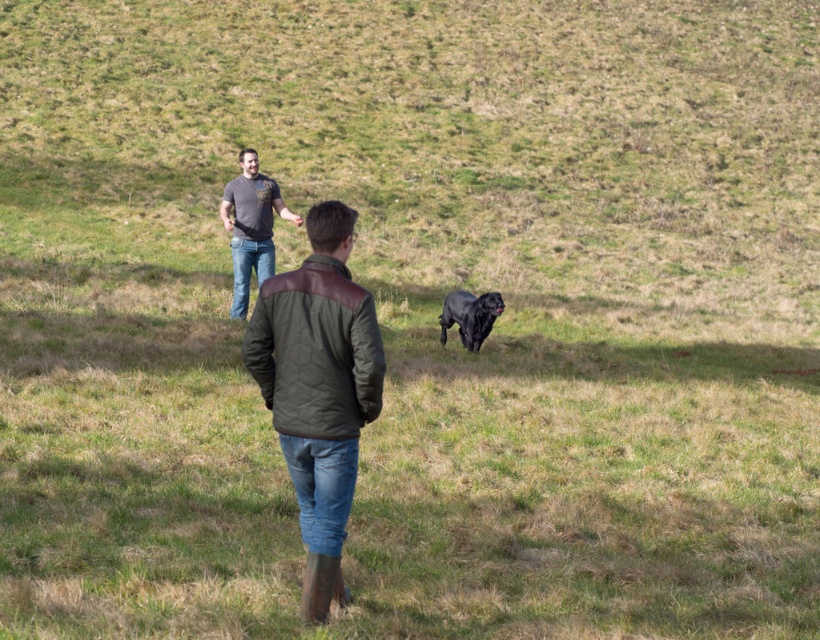
You are standing at the camera position and want to reach point (340, 444). Is the distance less than 7 meters?

The distance between point (340, 444) and the camera is 6.74 meters, which is less than 7 meters.